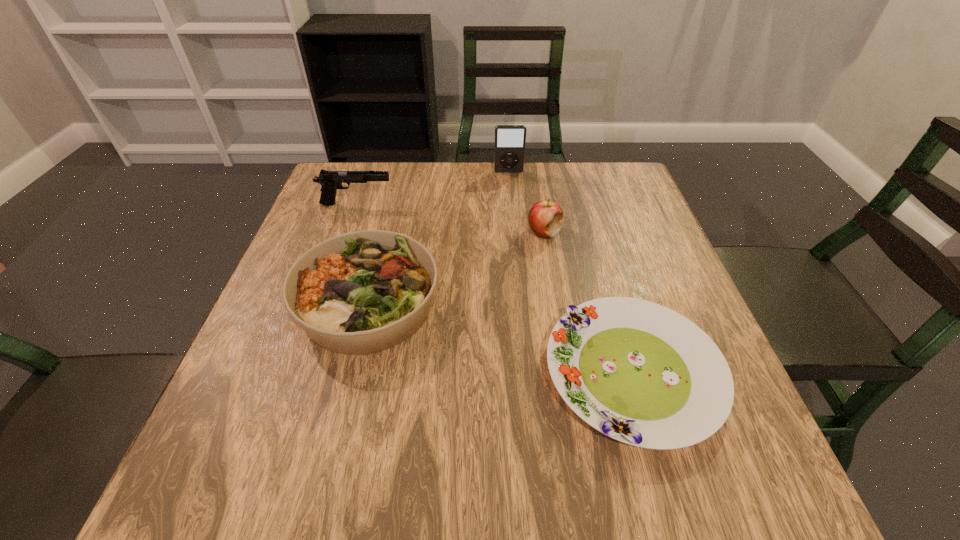
Image resolution: width=960 pixels, height=540 pixels. In the image, there is a desktop. What are the coordinates of `vacant space at the far edge` in the screenshot? It's located at (507, 174).

What are the coordinates of `blank space at the near edge of the desktop` in the screenshot? It's located at (563, 466).

In the image, there is a desktop. Find the location of `free space at the left edge`. free space at the left edge is located at coordinates (314, 245).

Find the location of a particular element. The image size is (960, 540). free space at the right edge is located at coordinates (644, 269).

Identify the location of vacant point at the far left corner. (319, 195).

In the image, there is a desktop. Identify the location of free space at the near left corner. This screenshot has height=540, width=960. (198, 508).

In the image, there is a desktop. Where is `vacant space at the far right corner`? This screenshot has height=540, width=960. vacant space at the far right corner is located at coordinates (629, 173).

You are a GUI agent. You are given a task and a screenshot of the screen. Output one action in this format:
    pyautogui.click(x=<x>, y=<y>)
    Task: Click on the free space between the taller salad plate and the apple
    The image size is (960, 540).
    Given the screenshot: What is the action you would take?
    pyautogui.click(x=456, y=268)

In order to click on free spot between the apple and the taller salad plate in this screenshot , I will do `click(456, 268)`.

The height and width of the screenshot is (540, 960). Find the location of `empty location between the third nearest object and the taller salad plate`. empty location between the third nearest object and the taller salad plate is located at coordinates (456, 268).